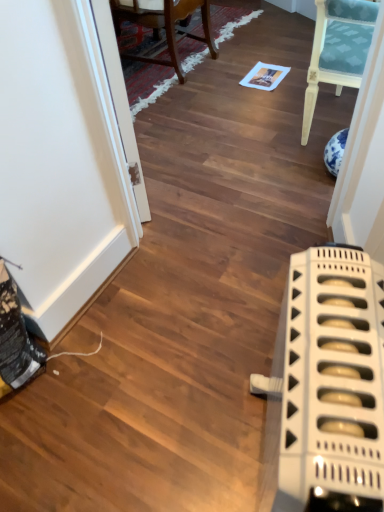
Question: Can you confirm if wooden chair at upper center is positioned to the left of white plastic radiator at lower right?

Choices:
 (A) no
 (B) yes

Answer: (B)

Question: From a real-world perspective, is wooden chair at upper center on top of white plastic radiator at lower right?

Choices:
 (A) yes
 (B) no

Answer: (B)

Question: Does wooden chair at upper center appear on the right side of white plastic radiator at lower right?

Choices:
 (A) yes
 (B) no

Answer: (B)

Question: Does wooden chair at upper center have a greater width compared to white plastic radiator at lower right?

Choices:
 (A) no
 (B) yes

Answer: (B)

Question: Is wooden chair at upper center taller than white plastic radiator at lower right?

Choices:
 (A) yes
 (B) no

Answer: (B)

Question: Is wooden chair at upper center facing towards white plastic radiator at lower right?

Choices:
 (A) yes
 (B) no

Answer: (B)

Question: Is transparent glass door at upper left outside of wooden chair at upper center?

Choices:
 (A) yes
 (B) no

Answer: (A)

Question: Is transparent glass door at upper left closer to the viewer compared to wooden chair at upper center?

Choices:
 (A) yes
 (B) no

Answer: (A)

Question: Is transparent glass door at upper left further to camera compared to wooden chair at upper center?

Choices:
 (A) no
 (B) yes

Answer: (A)

Question: Does transparent glass door at upper left have a smaller size compared to wooden chair at upper center?

Choices:
 (A) yes
 (B) no

Answer: (A)

Question: Is transparent glass door at upper left directly adjacent to wooden chair at upper center?

Choices:
 (A) no
 (B) yes

Answer: (A)

Question: From a real-world perspective, is transparent glass door at upper left beneath wooden chair at upper center?

Choices:
 (A) no
 (B) yes

Answer: (A)

Question: Are white plastic radiator at lower right and transparent glass door at upper left beside each other?

Choices:
 (A) no
 (B) yes

Answer: (A)